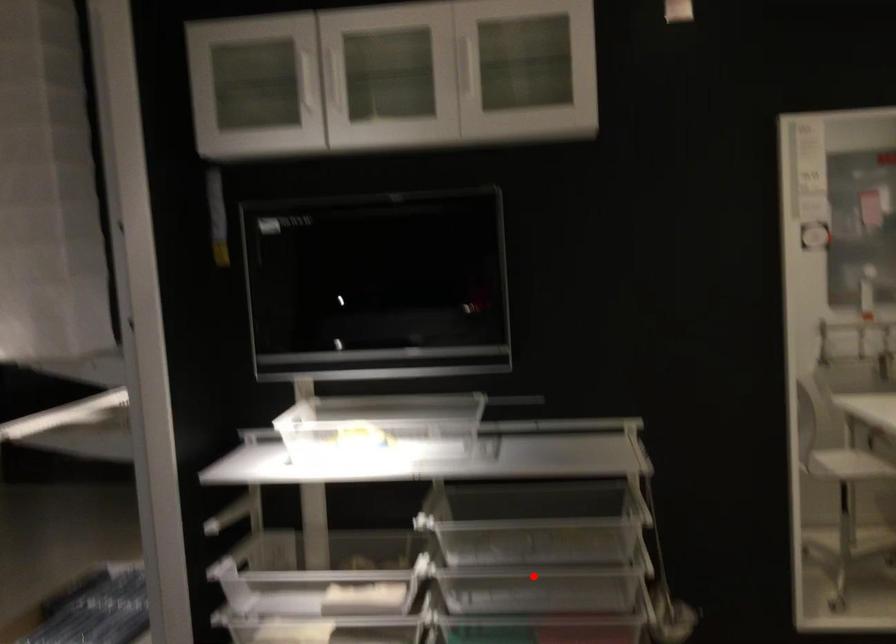
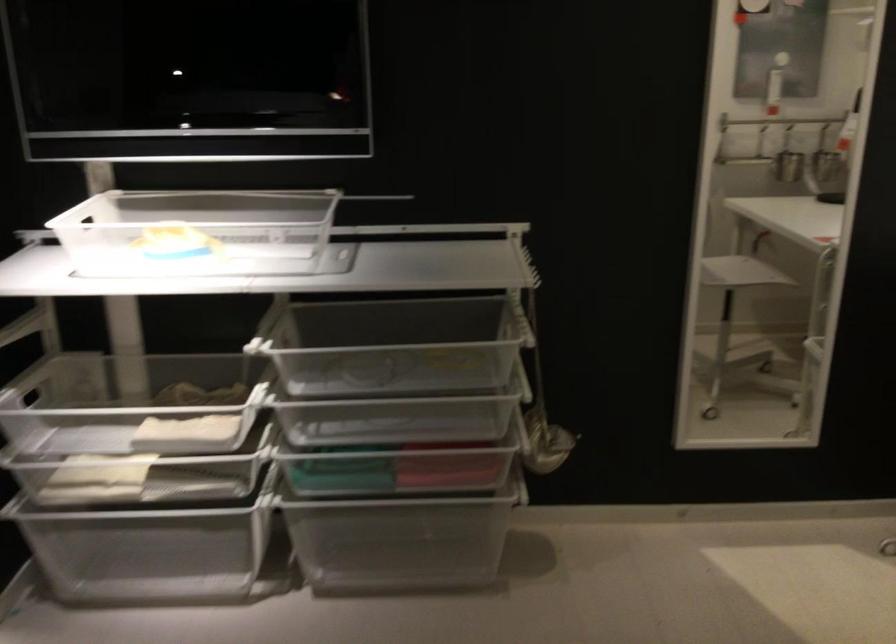
Locate, in the second image, the point that corresponds to the highlighted location in the first image.

(397, 406)